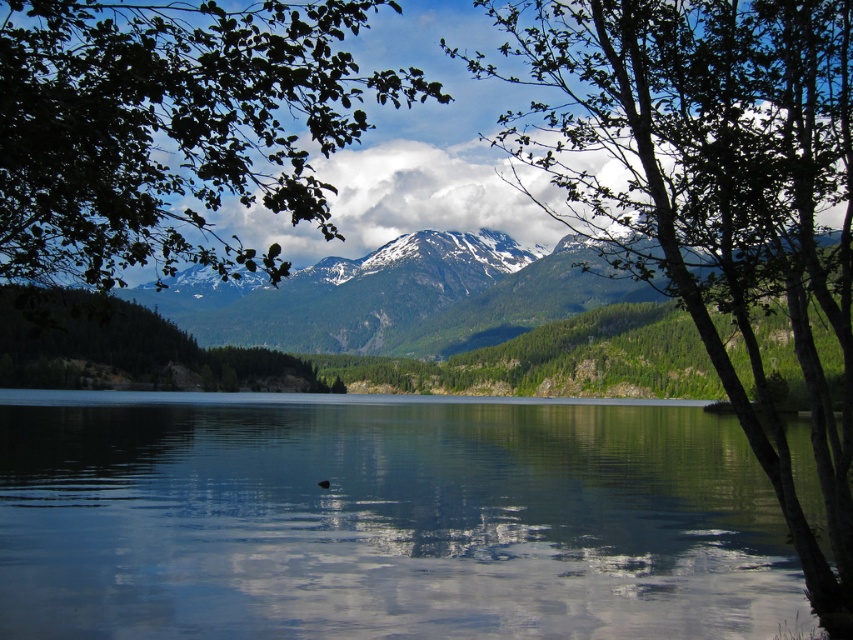
Question: Is transparent water at center to the right of green leafy tree at upper left from the viewer's perspective?

Choices:
 (A) no
 (B) yes

Answer: (B)

Question: Which of the following is the farthest from the observer?

Choices:
 (A) (743, 12)
 (B) (148, 253)

Answer: (A)

Question: Is the position of transparent water at center more distant than that of green leafy tree at center?

Choices:
 (A) yes
 (B) no

Answer: (A)

Question: Which point is closer to the camera taking this photo?

Choices:
 (A) (572, 404)
 (B) (120, 230)

Answer: (B)

Question: Which of the following is the closest to the observer?

Choices:
 (A) green leafy tree at upper left
 (B) transparent water at center
 (C) green leafy tree at center

Answer: (A)

Question: Is transparent water at center bigger than green leafy tree at upper left?

Choices:
 (A) yes
 (B) no

Answer: (B)